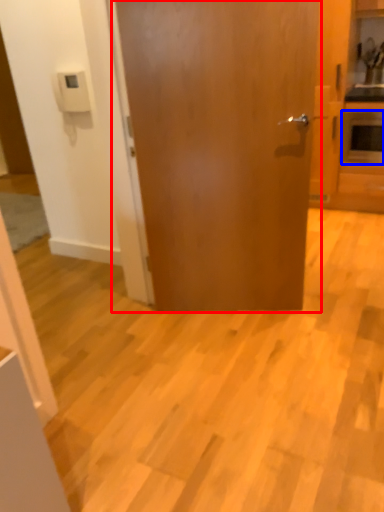
Question: Among these objects, which one is farthest to the camera, door (highlighted by a red box) or appliance (highlighted by a blue box)?

Choices:
 (A) door
 (B) appliance

Answer: (B)